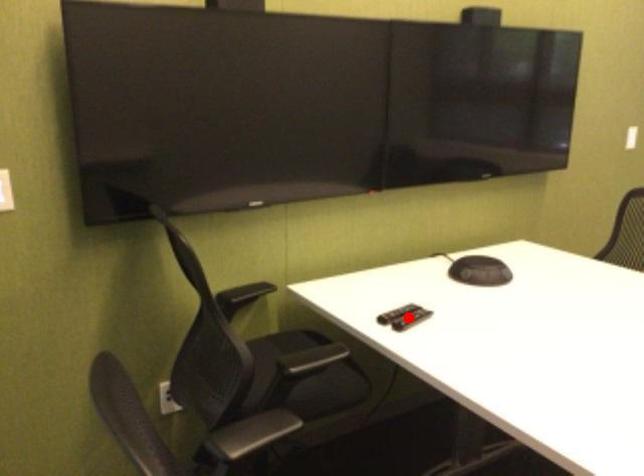
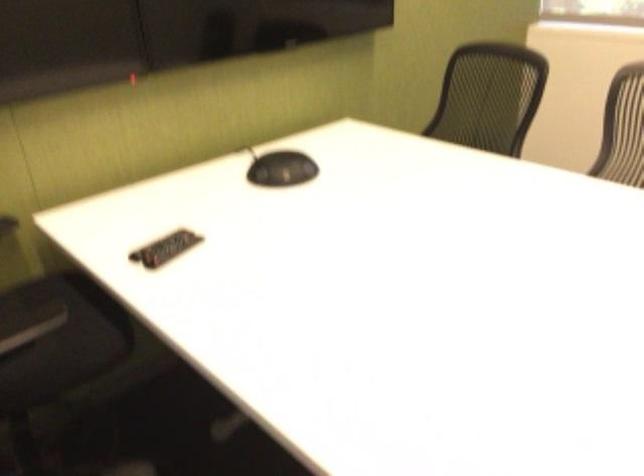
Question: I am providing you with two images of the same scene from different viewpoints. A red point is shown in image1. For the corresponding object point in image2, is it positioned nearer or farther from the camera?

Choices:
 (A) Nearer
 (B) Farther

Answer: (A)